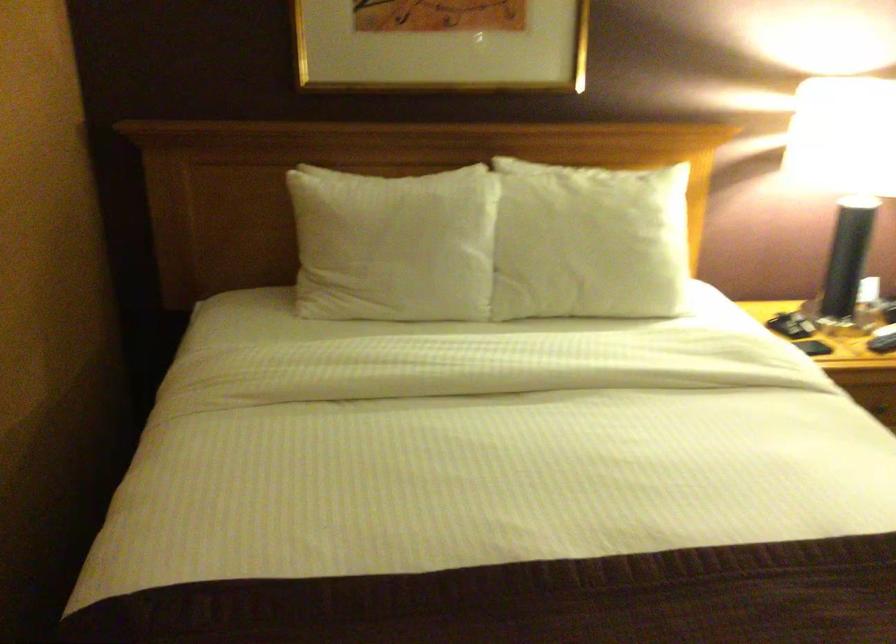
Where is `black smartphone`? This screenshot has height=644, width=896. black smartphone is located at coordinates (812, 345).